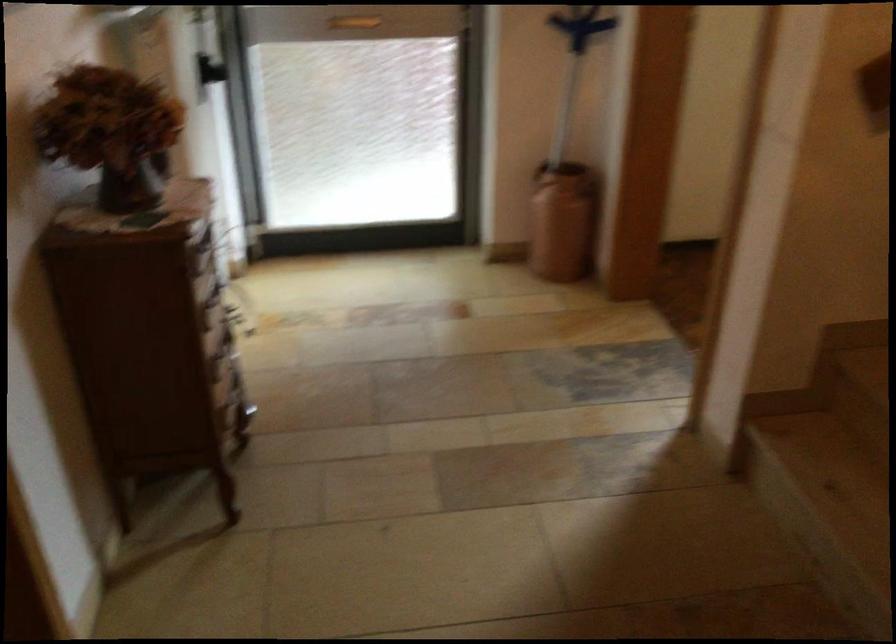
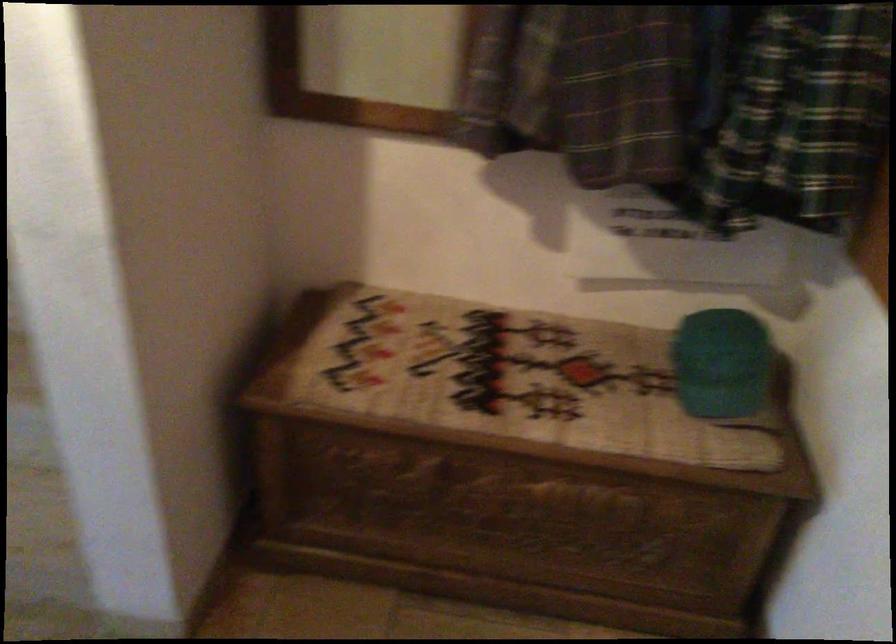
Based on the continuous images, in which direction is the camera rotating?

The rotation direction of the camera is right-down.